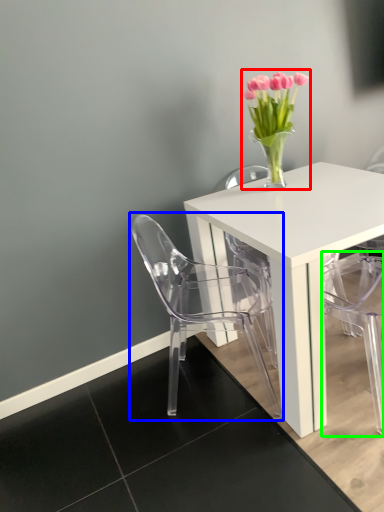
Question: Considering the real-world distances, which object is closest to floral arrangement (highlighted by a red box)? chair (highlighted by a blue box) or armchair (highlighted by a green box).

Choices:
 (A) chair
 (B) armchair

Answer: (A)